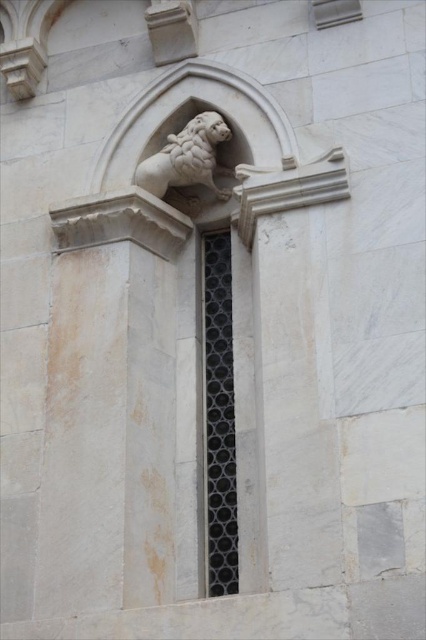
You are an architect inspecting the exterior wall of a building. You notice the black mesh window at center and the white marble lion at upper center. Based on their positions, which object is closer to the top of the wall?

The white marble lion at upper center is closer to the top of the wall because it is positioned above the black mesh window at center.

Based on the photo, you are standing in front of the building and notice a point marked at coordinates (x=218, y=417). Based on the scene description, what object does this point correspond to?

The point at coordinates (x=218, y=417) corresponds to the black mesh window at center.

You are an architect designing a new building and want to ensure proper proportions between the black mesh window at center and the white marble lion at upper center. Based on the image, which object should be placed higher to maintain visual balance?

The black mesh window at center should be placed higher since it is taller than the white marble lion at upper center, so elevating it would help maintain visual balance.